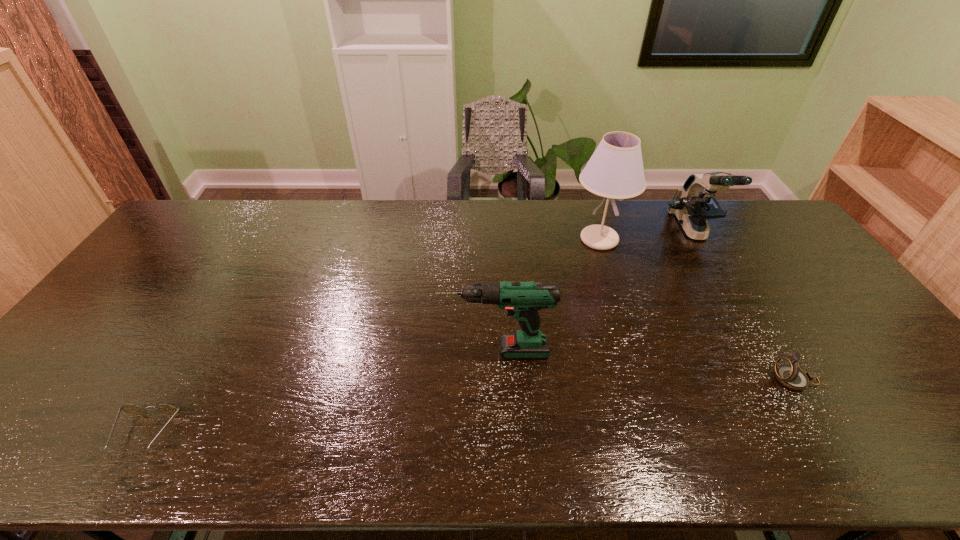
The height and width of the screenshot is (540, 960). Identify the location of the tallest object. (615, 170).

Image resolution: width=960 pixels, height=540 pixels. I want to click on lampshade, so click(x=615, y=170).

At what (x,y) coordinates should I click in order to perform the action: click on microscope. Please return your answer as a coordinate pair (x, y). Looking at the image, I should click on (694, 203).

Find the location of a particular element. drill is located at coordinates (522, 300).

Locate an element on the screen. The width and height of the screenshot is (960, 540). the second object from left to right is located at coordinates (522, 300).

Locate an element on the screen. the second nearest object is located at coordinates (787, 371).

Locate an element on the screen. compass is located at coordinates (787, 371).

Identify the location of spectacles. This screenshot has height=540, width=960. (132, 409).

Image resolution: width=960 pixels, height=540 pixels. Identify the location of the leftmost object. (132, 409).

The width and height of the screenshot is (960, 540). I want to click on vacant space located on the front of the lampshade, so pos(617,296).